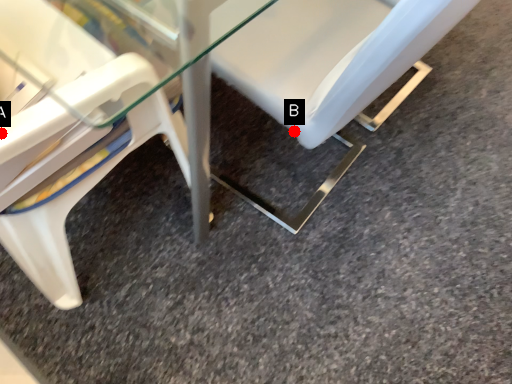
Question: Two points are circled on the image, labeled by A and B beside each circle. Which point appears farthest from the camera in this image?

Choices:
 (A) A is further
 (B) B is further

Answer: (B)